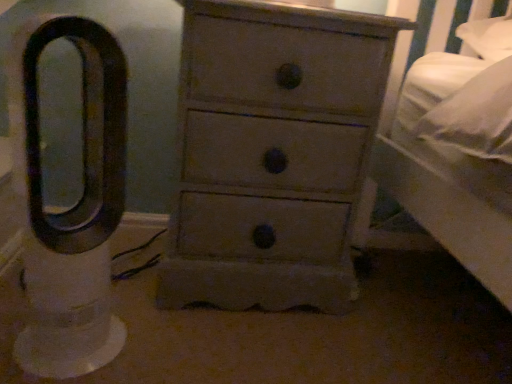
I want to click on free location in front of matte gray chest of drawers at center, so click(248, 352).